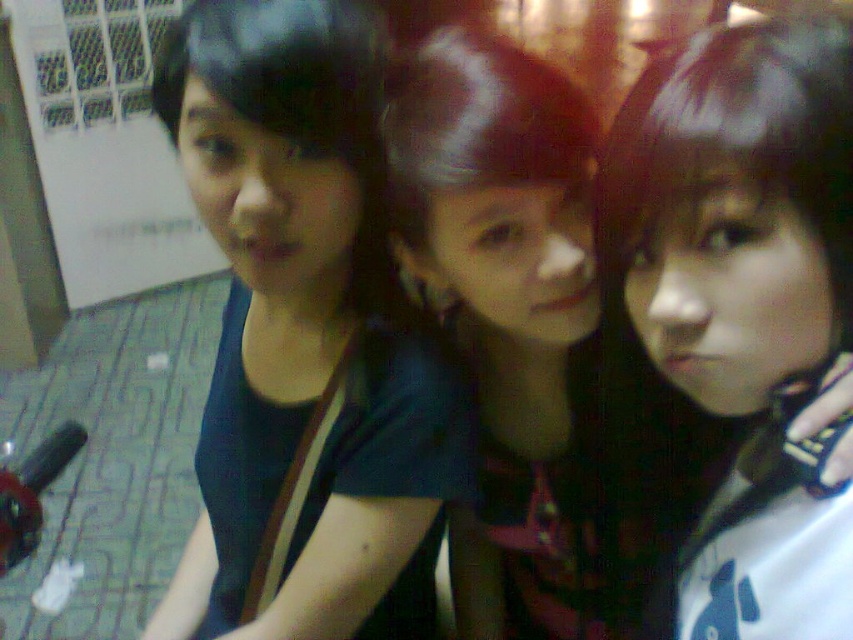
You are taking a photo of three people standing close together indoors. The person in the center has matte black hair. Where exactly is the matte black hair at center positioned in the image?

The matte black hair at center is located at point coordinates 0.483 on the x axis and 0.878 on the y axis.

You are a photographer adjusting your camera settings to focus on the matte black hair at center and the matte black shirt at center. Which object should you focus on first to ensure proper depth of field?

The matte black hair at center is closer to the viewer than the matte black shirt at center, so you should focus on the matte black hair at center first to ensure proper depth of field.

You are taking a photo of three people standing close together. You notice two objects labeled as matte black hair at center and matte black shirt at center. Which one is positioned to the right of the other?

The matte black hair at center is to the right of the matte black shirt at center according to the description.